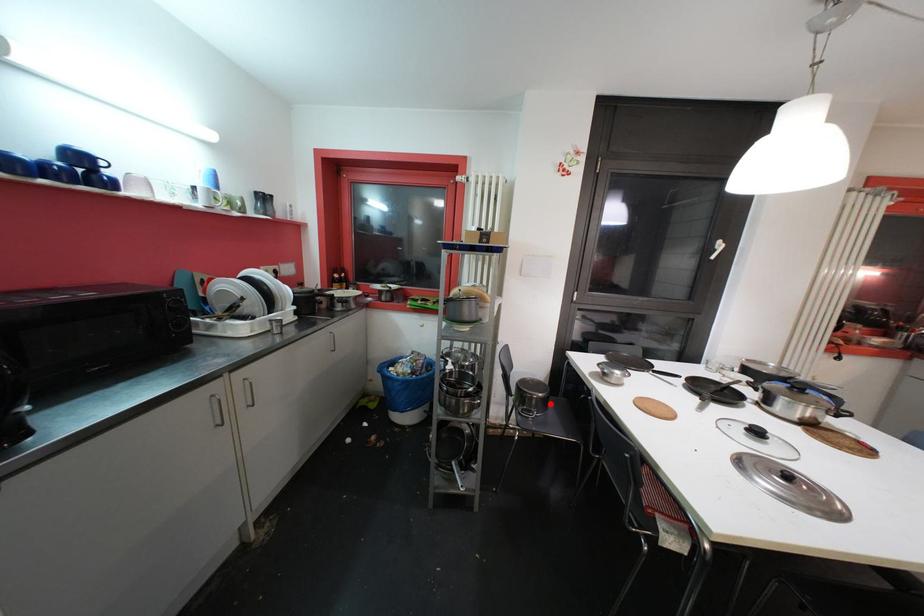
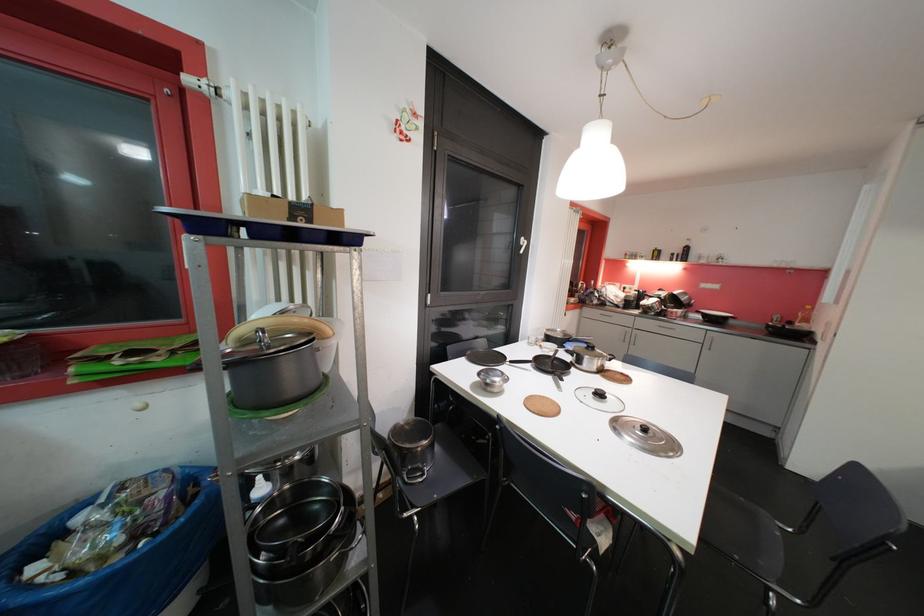
Question: I am providing you with two images of the same scene from different viewpoints. Image1 has a red point marked. In image2, the corresponding 3D location appears at what relative position? Reply with the corresponding letter.

Choices:
 (A) Closer
 (B) Farther

Answer: (A)